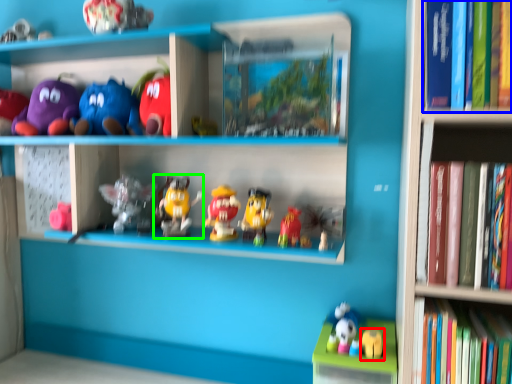
Question: Estimate the real-world distances between objects in this image. Which object is farther from toy (highlighted by a red box), book (highlighted by a blue box) or toy (highlighted by a green box)?

Choices:
 (A) book
 (B) toy

Answer: (A)